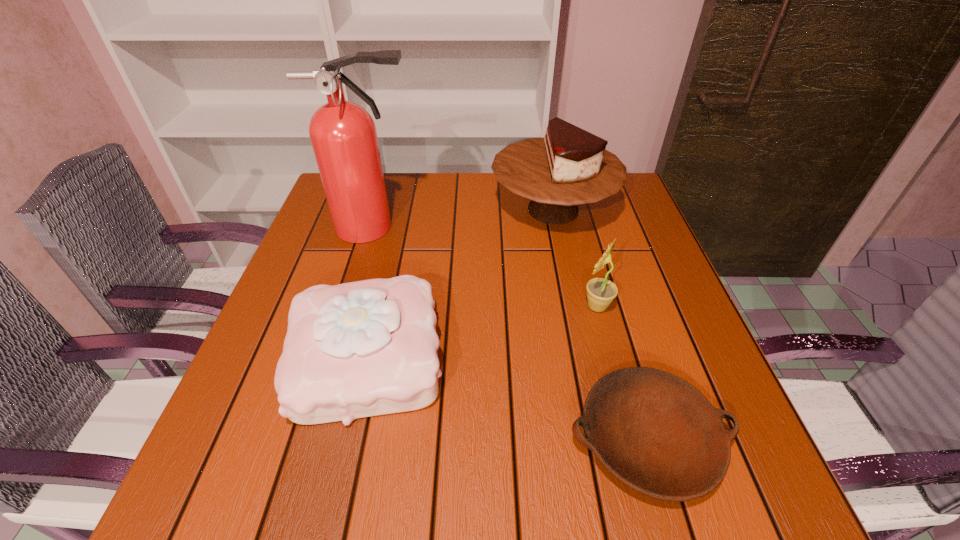
The width and height of the screenshot is (960, 540). I want to click on the tallest object, so click(x=343, y=134).

Image resolution: width=960 pixels, height=540 pixels. What are the coordinates of `the taller cake` in the screenshot? It's located at (569, 166).

Image resolution: width=960 pixels, height=540 pixels. What are the coordinates of `the farther cake` in the screenshot? It's located at coord(569,166).

In order to click on the third shortest object in this screenshot , I will do `click(600, 291)`.

Locate an element on the screen. The width and height of the screenshot is (960, 540). the fourth tallest object is located at coordinates (365, 348).

This screenshot has height=540, width=960. What are the coordinates of `the shorter cake` in the screenshot? It's located at (365, 348).

Where is `the shortest object`? the shortest object is located at coordinates [x=655, y=432].

The width and height of the screenshot is (960, 540). Identify the location of free region located on the back of the fire extinguisher. (389, 176).

Identify the location of vacant space located 0.260m on the front of the taller cake. (579, 330).

What are the coordinates of `free space located on the face of the sunflower` in the screenshot? It's located at (419, 306).